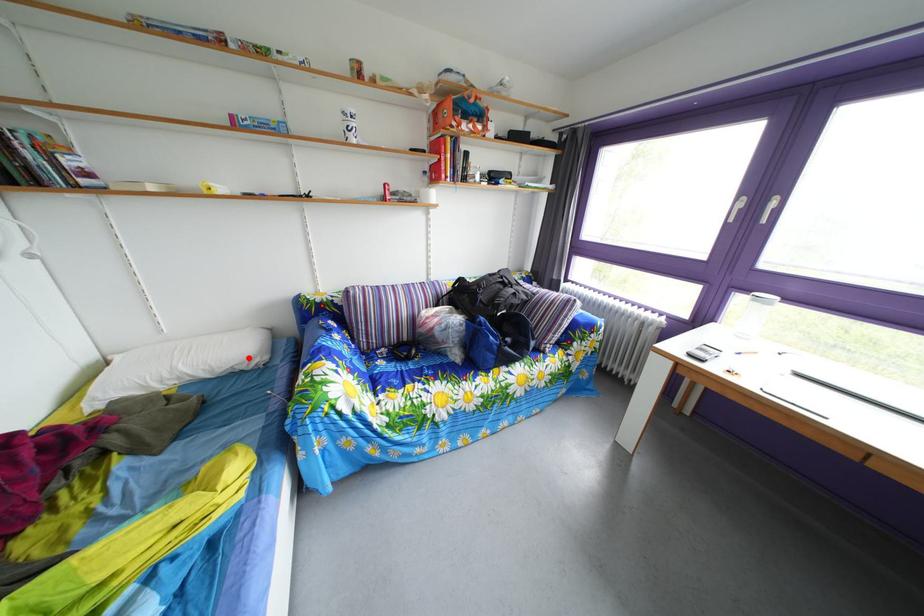
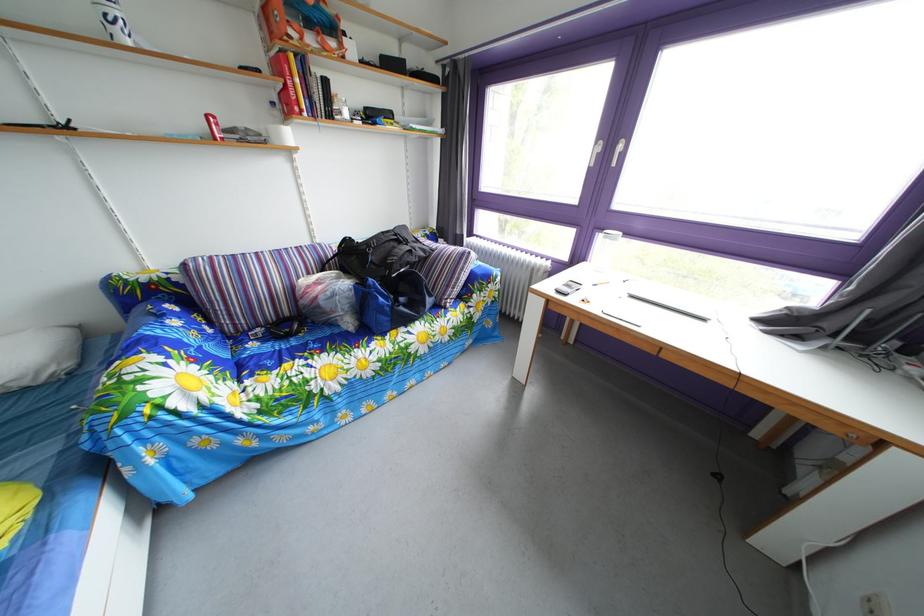
Question: I am providing you with two images of the same scene from different viewpoints. Image1 has a red point marked. In image2, the corresponding 3D location appears at what relative position? Reply with the corresponding letter.

Choices:
 (A) Closer
 (B) Farther

Answer: (B)